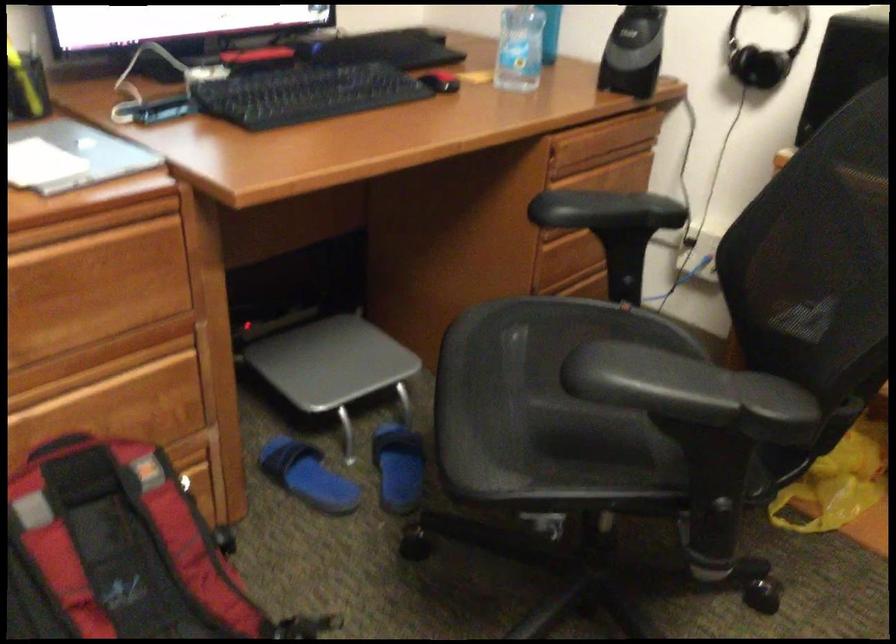
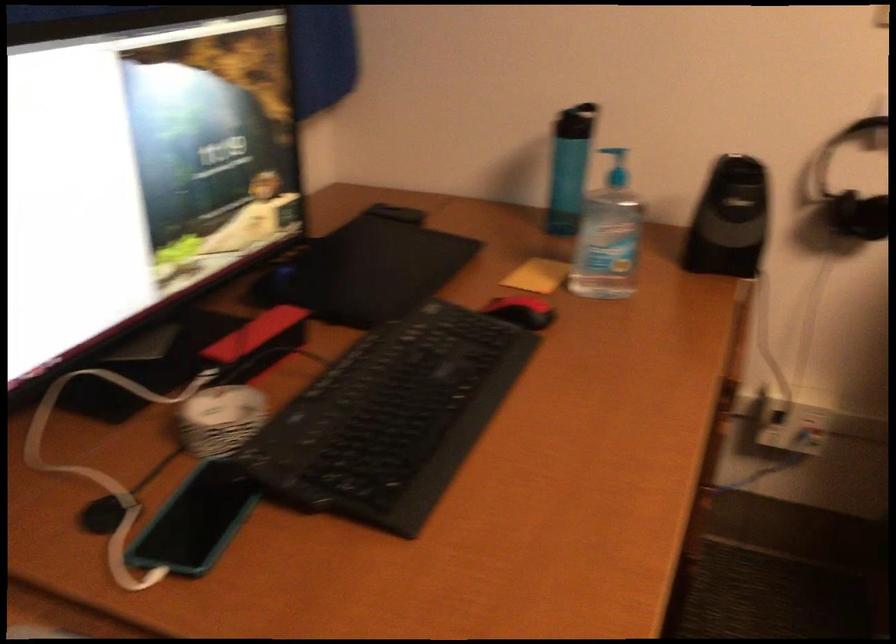
Which direction would the cameraman need to move to produce the second image?

The cameraman moved toward left, forward.